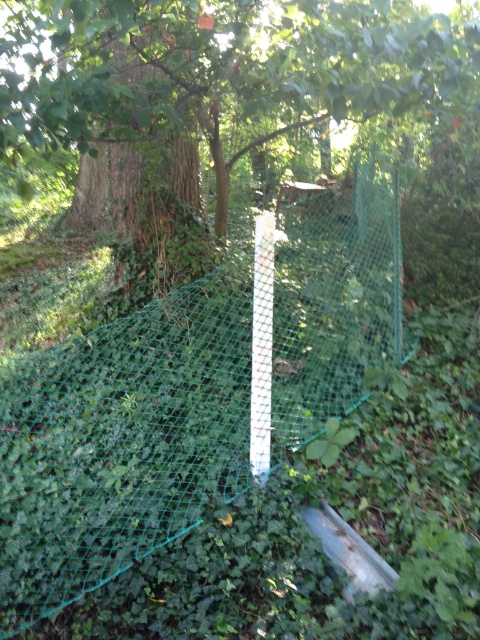
You are standing in the forest and want to take a photo of both the green netting structure and the ivy covered ground. You notice two specific points marked as point 1 at coordinates (x=411, y=29) and point 2 at coordinates (x=264, y=397). Which point is closer to your camera lens when you aim to capture both in the frame?

Point 1 at coordinates (x=411, y=29) is closer to the camera lens than point 2 at coordinates (x=264, y=397).

You need to determine if the green mesh net at center can be fully supported by the white plastic pole at center. Based on their sizes, what do you think?

The green mesh net at center has a larger width than the white plastic pole at center, so it may not be fully supported by the pole unless additional support is added.

You are a gardener who needs to choose between the green mesh net at center and the green mesh fence at center for covering a new plant bed. Based on their sizes, which one would you recommend for better coverage?

The green mesh net at center is bigger than the green mesh fence at center, so it would provide better coverage for the plant bed.